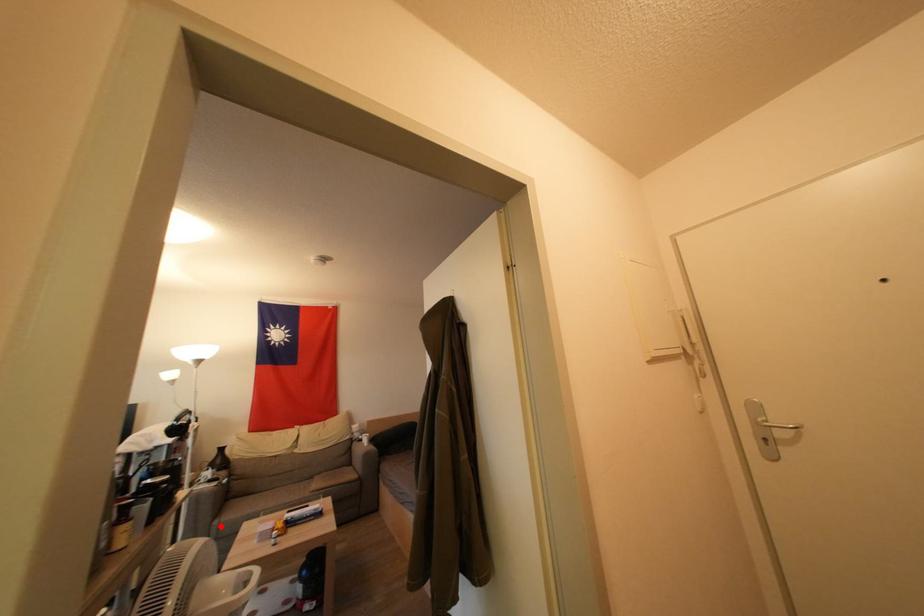
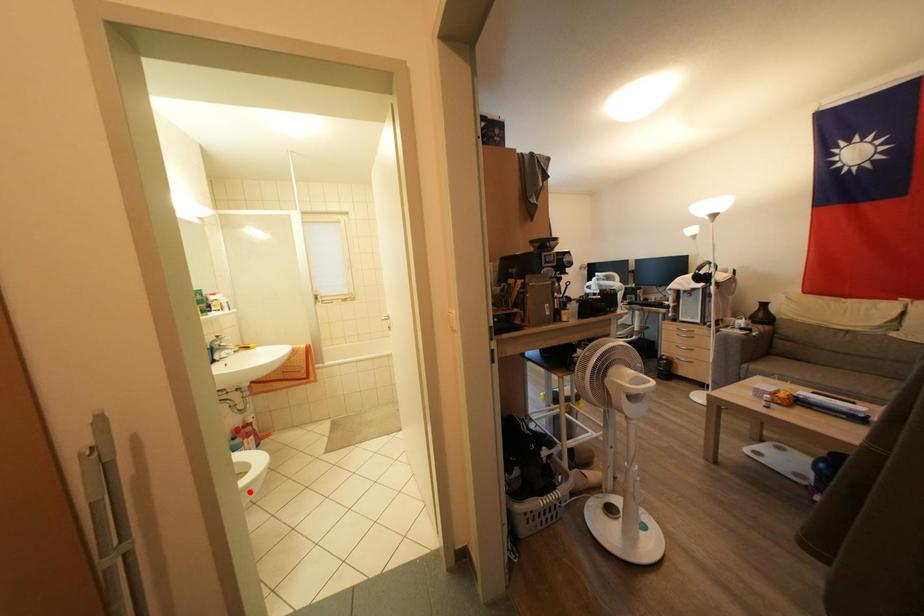
I am providing you with two images of the same scene from different viewpoints. A red point is marked on the first image and another point is marked on the second image. Do the highlighted points in image1 and image2 indicate the same real-world spot?

No